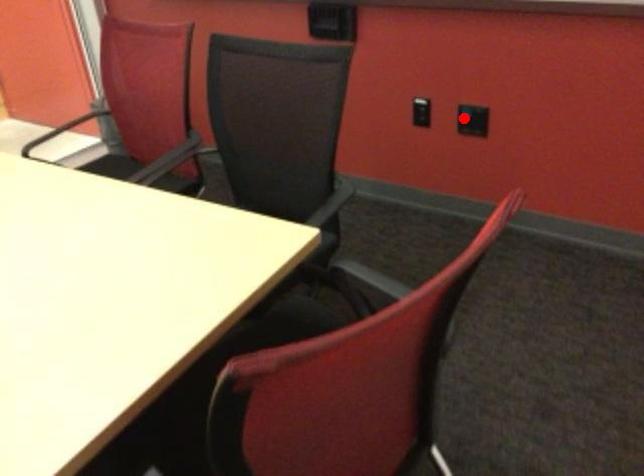
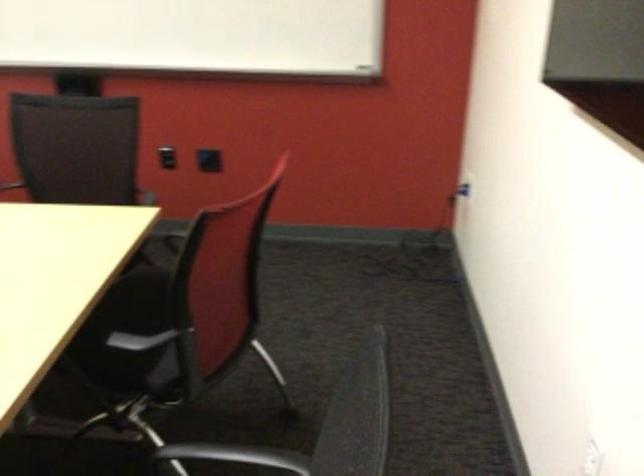
Question: I am providing you with two images of the same scene from different viewpoints. In image1, a red point is highlighted. Considering the same 3D point in image2, which of the following is correct?

Choices:
 (A) It is closer
 (B) It is farther

Answer: (B)